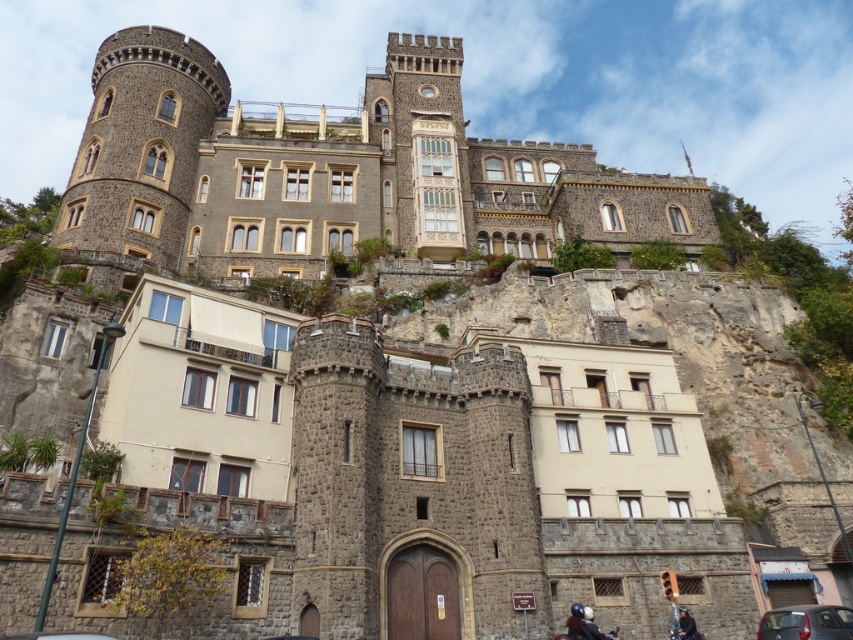
Question: Does dark gray leather jacket at lower right appear over shiny black motorcycle at lower center?

Choices:
 (A) yes
 (B) no

Answer: (A)

Question: Which point is farther from the camera taking this photo?

Choices:
 (A) (607, 636)
 (B) (828, 621)
 (C) (683, 636)

Answer: (A)

Question: Among these points, which one is nearest to the camera?

Choices:
 (A) (596, 627)
 (B) (367, 228)
 (C) (692, 634)

Answer: (A)

Question: Is dark gray stone castle at upper center wider than shiny blue helmet at lower center?

Choices:
 (A) no
 (B) yes

Answer: (B)

Question: Does matte black car at lower right appear over shiny blue helmet at lower center?

Choices:
 (A) no
 (B) yes

Answer: (B)

Question: Which point is closer to the camera taking this photo?

Choices:
 (A) (554, 637)
 (B) (692, 618)

Answer: (A)